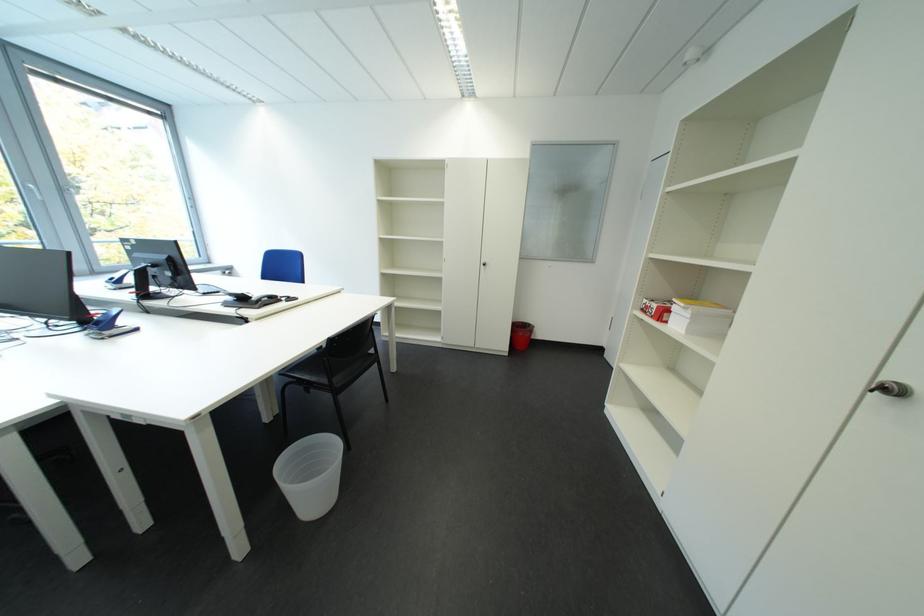
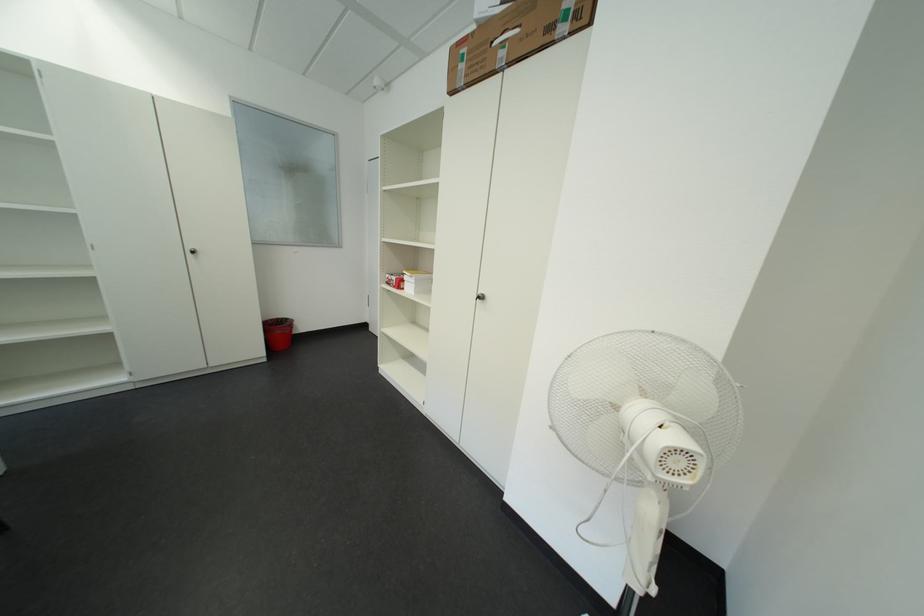
Find the pixel in the second image that matches the point at 675,315 in the first image.

(411, 286)